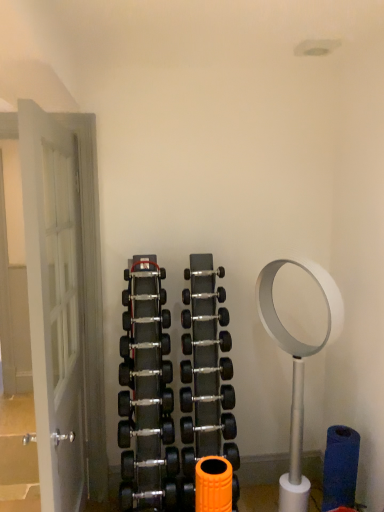
Question: Is the depth of polished silver dumbbell at center, arranged as the eighth dumbbell when viewed from the top, less than that of polished silver dumbbell at center, placed as the fifth dumbbell when sorted from bottom to top?

Choices:
 (A) yes
 (B) no

Answer: (B)

Question: Can you confirm if polished silver dumbbell at center, arranged as the eighth dumbbell when viewed from the top, is positioned to the right of polished silver dumbbell at center, placed as the fifth dumbbell when sorted from bottom to top?

Choices:
 (A) no
 (B) yes

Answer: (B)

Question: From a real-world perspective, is polished silver dumbbell at center, which is the fourth dumbbell from bottom to top, over polished silver dumbbell at center, which ranks as the seventh dumbbell in top-to-bottom order?

Choices:
 (A) yes
 (B) no

Answer: (B)

Question: Is polished silver dumbbell at center, which is the fourth dumbbell from bottom to top, smaller than polished silver dumbbell at center, which ranks as the seventh dumbbell in top-to-bottom order?

Choices:
 (A) yes
 (B) no

Answer: (B)

Question: From the image's perspective, does polished silver dumbbell at center, arranged as the eighth dumbbell when viewed from the top, appear lower than polished silver dumbbell at center, placed as the fifth dumbbell when sorted from bottom to top?

Choices:
 (A) yes
 (B) no

Answer: (A)

Question: Is polished silver dumbbell at center, placed as the fifth dumbbell when sorted from bottom to top, inside polished silver dumbbell at center, which is the fourth dumbbell from bottom to top?

Choices:
 (A) no
 (B) yes

Answer: (A)

Question: Would you say polished silver dumbbell at center, which ranks as the seventh dumbbell in top-to-bottom order, is outside white wooden door at left?

Choices:
 (A) no
 (B) yes

Answer: (B)

Question: Is polished silver dumbbell at center, which ranks as the seventh dumbbell in top-to-bottom order, not close to white wooden door at left?

Choices:
 (A) yes
 (B) no

Answer: (B)

Question: Can you confirm if polished silver dumbbell at center, which ranks as the seventh dumbbell in top-to-bottom order, is smaller than white wooden door at left?

Choices:
 (A) yes
 (B) no

Answer: (A)

Question: Is polished silver dumbbell at center, which ranks as the seventh dumbbell in top-to-bottom order, oriented away from white wooden door at left?

Choices:
 (A) no
 (B) yes

Answer: (A)

Question: From the image's perspective, would you say polished silver dumbbell at center, which ranks as the seventh dumbbell in top-to-bottom order, is positioned over white wooden door at left?

Choices:
 (A) yes
 (B) no

Answer: (B)

Question: Considering the relative sizes of polished silver dumbbell at center, which ranks as the seventh dumbbell in top-to-bottom order, and white wooden door at left in the image provided, is polished silver dumbbell at center, which ranks as the seventh dumbbell in top-to-bottom order, taller than white wooden door at left?

Choices:
 (A) yes
 (B) no

Answer: (B)

Question: Is black rubber dumbbell at center, the seventh dumbbell positioned from the bottom, to the left of black rubber dumbbell at center, the ninth dumbbell positioned from the bottom, from the viewer's perspective?

Choices:
 (A) no
 (B) yes

Answer: (A)